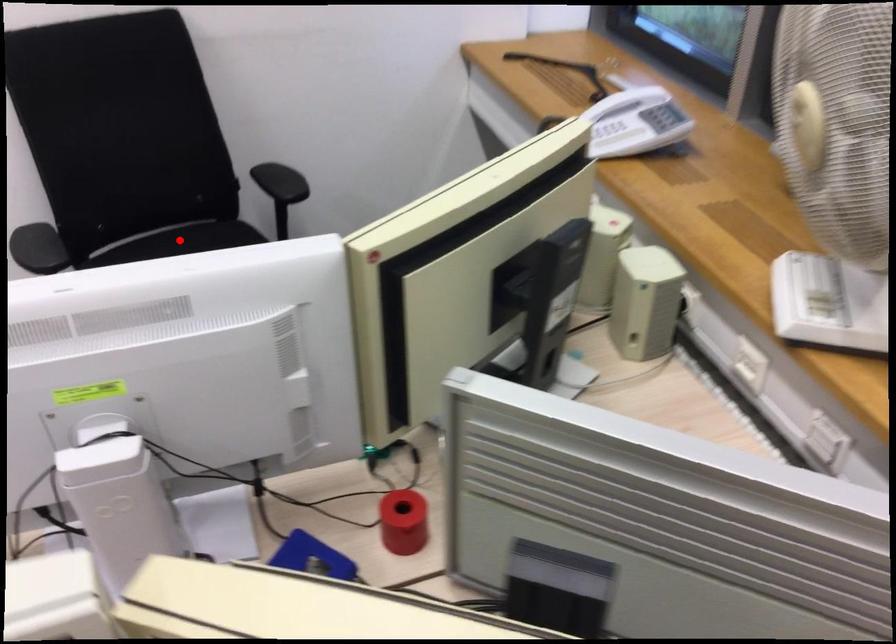
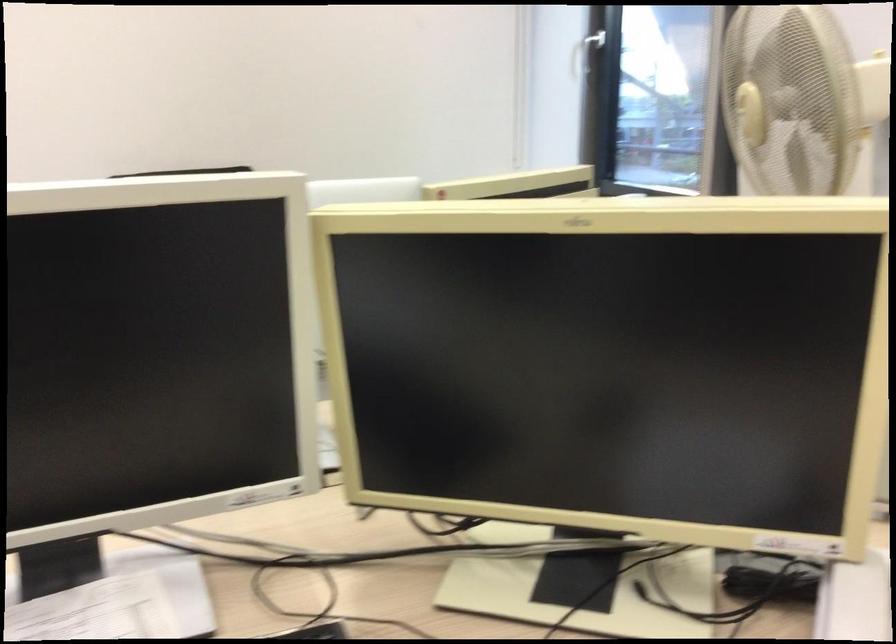
Question: I am providing you with two images of the same scene from different viewpoints. A red point is marked on the first image. Can you still see the location of the red point in image 2?

Choices:
 (A) Yes
 (B) No

Answer: (B)